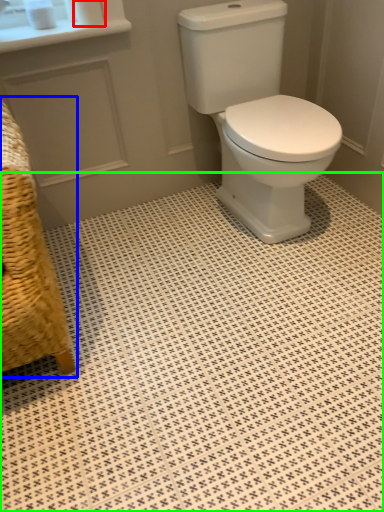
Question: Which object is positioned closest to toilet paper (highlighted by a red box)? Select from armchair (highlighted by a blue box) and ceramic tile (highlighted by a green box).

Choices:
 (A) armchair
 (B) ceramic tile

Answer: (A)